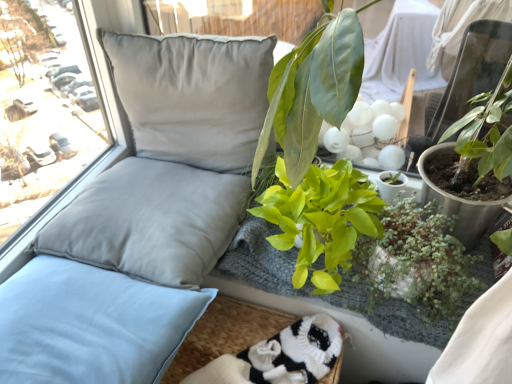
Question: Considering the relative sizes of satin gray pillow at upper left, acting as the 1th pillow starting from the top, and green leafy plant at upper right, which is counted as the second floral arrangement, starting from the bottom, in the image provided, is satin gray pillow at upper left, acting as the 1th pillow starting from the top, taller than green leafy plant at upper right, which is counted as the second floral arrangement, starting from the bottom,?

Choices:
 (A) no
 (B) yes

Answer: (A)

Question: Is satin gray pillow at upper left, which is the third pillow in bottom-to-top order, closer to the viewer compared to green leafy plant at upper right, which is counted as the second floral arrangement, starting from the bottom?

Choices:
 (A) yes
 (B) no

Answer: (B)

Question: Is satin gray pillow at upper left, which is the third pillow in bottom-to-top order, to the left of green leafy plant at upper right, acting as the 1th floral arrangement starting from the top, from the viewer's perspective?

Choices:
 (A) yes
 (B) no

Answer: (A)

Question: From a real-world perspective, is satin gray pillow at upper left, acting as the 1th pillow starting from the top, beneath green leafy plant at upper right, acting as the 1th floral arrangement starting from the top?

Choices:
 (A) yes
 (B) no

Answer: (A)

Question: Is satin gray pillow at upper left, acting as the 1th pillow starting from the top, located outside green leafy plant at upper right, which is counted as the second floral arrangement, starting from the bottom?

Choices:
 (A) no
 (B) yes

Answer: (B)

Question: From the image's perspective, is satin gray pillow at upper left, acting as the 1th pillow starting from the top, on top of green leafy plant at upper right, acting as the 1th floral arrangement starting from the top?

Choices:
 (A) yes
 (B) no

Answer: (A)

Question: Does light blue fabric pillow at left, placed as the first pillow when sorted from bottom to top, lie in front of green leafy plant at center, the first floral arrangement in the bottom-to-top sequence?

Choices:
 (A) yes
 (B) no

Answer: (A)

Question: Does light blue fabric pillow at left, the third pillow in the top-to-bottom sequence, turn towards green leafy plant at center, the first floral arrangement in the bottom-to-top sequence?

Choices:
 (A) no
 (B) yes

Answer: (A)

Question: Does light blue fabric pillow at left, the third pillow in the top-to-bottom sequence, appear on the right side of green leafy plant at center, which ranks as the second floral arrangement in top-to-bottom order?

Choices:
 (A) no
 (B) yes

Answer: (A)

Question: Is light blue fabric pillow at left, the third pillow in the top-to-bottom sequence, shorter than green leafy plant at center, the first floral arrangement in the bottom-to-top sequence?

Choices:
 (A) no
 (B) yes

Answer: (A)

Question: Would you say light blue fabric pillow at left, the third pillow in the top-to-bottom sequence, is a long distance from green leafy plant at center, which ranks as the second floral arrangement in top-to-bottom order?

Choices:
 (A) yes
 (B) no

Answer: (B)

Question: Considering the relative positions of light blue fabric pillow at left, the third pillow in the top-to-bottom sequence, and green leafy plant at center, the first floral arrangement in the bottom-to-top sequence, in the image provided, is light blue fabric pillow at left, the third pillow in the top-to-bottom sequence, behind green leafy plant at center, the first floral arrangement in the bottom-to-top sequence,?

Choices:
 (A) no
 (B) yes

Answer: (A)

Question: Can you confirm if green leafy plant at center, the first floral arrangement in the bottom-to-top sequence, is positioned to the right of green glossy plant at center, arranged as the second houseplant when viewed from the right?

Choices:
 (A) yes
 (B) no

Answer: (A)